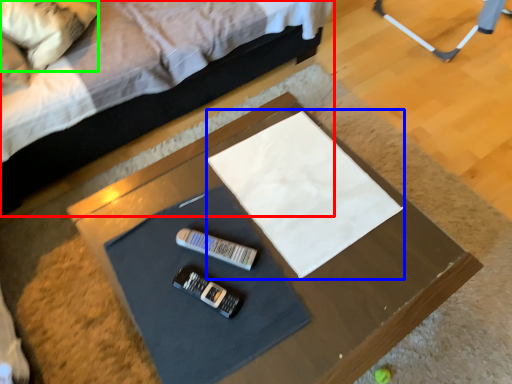
Question: Estimate the real-world distances between objects in this image. Which object is farther from bed (highlighted by a red box), linen (highlighted by a blue box) or pillow (highlighted by a green box)?

Choices:
 (A) linen
 (B) pillow

Answer: (A)